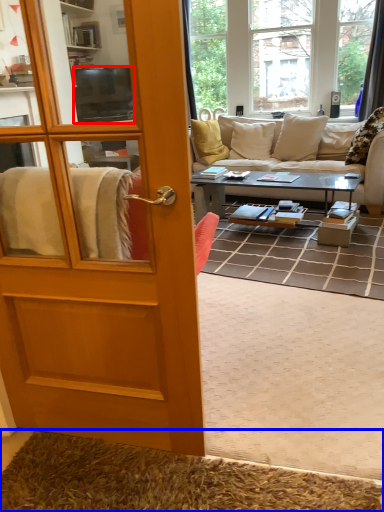
Question: Which object is further to the camera taking this photo, television (highlighted by a red box) or doormat (highlighted by a blue box)?

Choices:
 (A) television
 (B) doormat

Answer: (A)